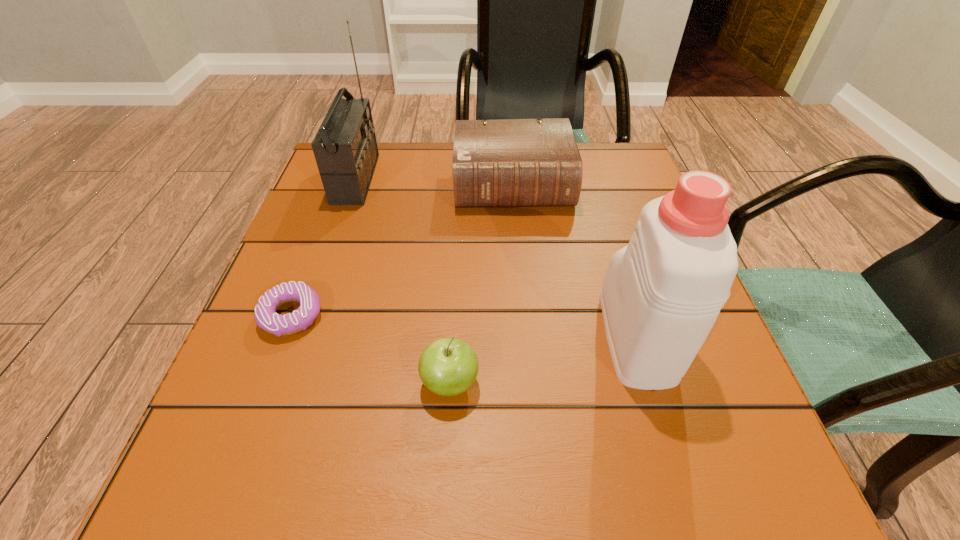
The image size is (960, 540). Find the location of `vacant space that is in between the fourth tallest object and the Bible`. vacant space that is in between the fourth tallest object and the Bible is located at coordinates (481, 284).

Identify the location of free space between the detergent and the Bible. (574, 260).

Choose which object is the third nearest neighbor to the apple. Please provide its 2D coordinates. Your answer should be formatted as a tuple, i.e. [(x, y)], where the tuple contains the x and y coordinates of a point satisfying the conditions above.

[(513, 162)]

Locate which object ranks fourth in proximity to the radio receiver. Please provide its 2D coordinates. Your answer should be formatted as a tuple, i.e. [(x, y)], where the tuple contains the x and y coordinates of a point satisfying the conditions above.

[(662, 293)]

Locate an element on the screen. Image resolution: width=960 pixels, height=540 pixels. blank area in the image that satisfies the following two spatial constraints: 1. on the handle side of the detergent; 2. on the front panel of the radio receiver is located at coordinates (588, 179).

Locate an element on the screen. The width and height of the screenshot is (960, 540). free point that satisfies the following two spatial constraints: 1. on the front panel of the radio receiver; 2. on the handle side of the detergent is located at coordinates [x=302, y=335].

Locate an element on the screen. Image resolution: width=960 pixels, height=540 pixels. free space that satisfies the following two spatial constraints: 1. on the front panel of the radio receiver; 2. on the handle side of the detergent is located at coordinates click(x=302, y=335).

Find the location of a particular element. Image resolution: width=960 pixels, height=540 pixels. vacant point that satisfies the following two spatial constraints: 1. on the back side of the second shortest object; 2. on the front panel of the radio receiver is located at coordinates (461, 179).